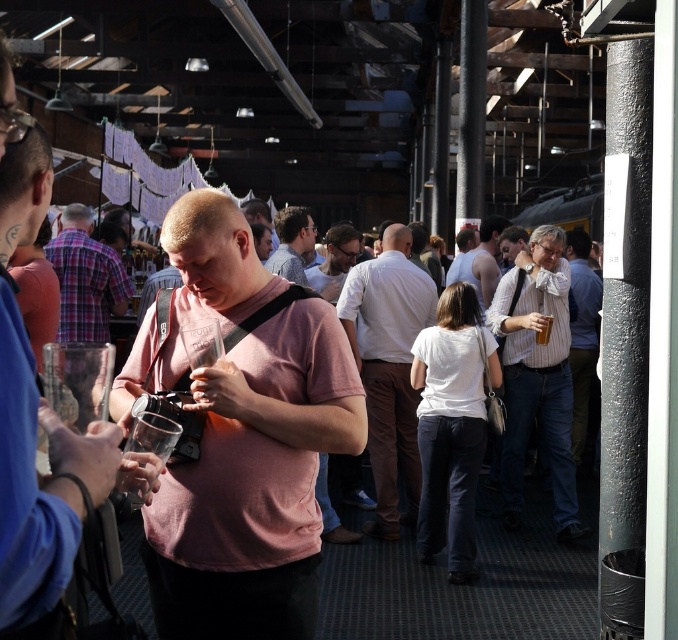
Which is below, white striped shirt at right or striped shirt at right?

white striped shirt at right is below.

Where is `white striped shirt at right`? Image resolution: width=678 pixels, height=640 pixels. white striped shirt at right is located at coordinates (536, 376).

Is pink cotton shirt at center smaller than plaid fabric shirt at center?

Yes, pink cotton shirt at center is smaller than plaid fabric shirt at center.

Between point (14, 221) and point (73, 253), which one is positioned in front?

Point (14, 221)

Is point (71, 444) positioned before point (71, 285)?

That is True.

This screenshot has width=678, height=640. Identify the location of pink cotton shirt at center. (35, 413).

Is pink matte shirt at center smaller than white striped shirt at right?

Correct, pink matte shirt at center occupies less space than white striped shirt at right.

Does pink matte shirt at center appear over white striped shirt at right?

Correct, pink matte shirt at center is located above white striped shirt at right.

The width and height of the screenshot is (678, 640). In order to click on pink matte shirt at center in this screenshot , I will do `click(254, 483)`.

Where is `pink matte shirt at center`? pink matte shirt at center is located at coordinates (254, 483).